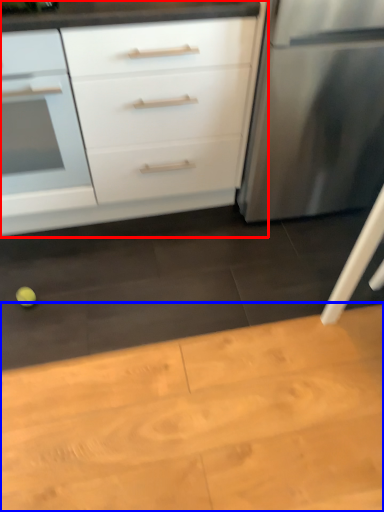
Question: Which object is further to the camera taking this photo, chest of drawers (highlighted by a red box) or table (highlighted by a blue box)?

Choices:
 (A) chest of drawers
 (B) table

Answer: (A)